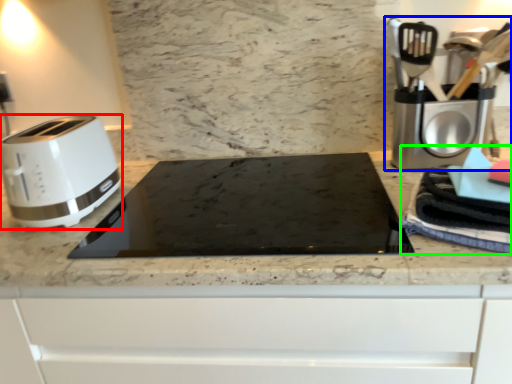
Question: Estimate the real-world distances between objects in this image. Which object is farther from toaster (highlighted by a red box), coffee machine (highlighted by a blue box) or blanket (highlighted by a green box)?

Choices:
 (A) coffee machine
 (B) blanket

Answer: (A)